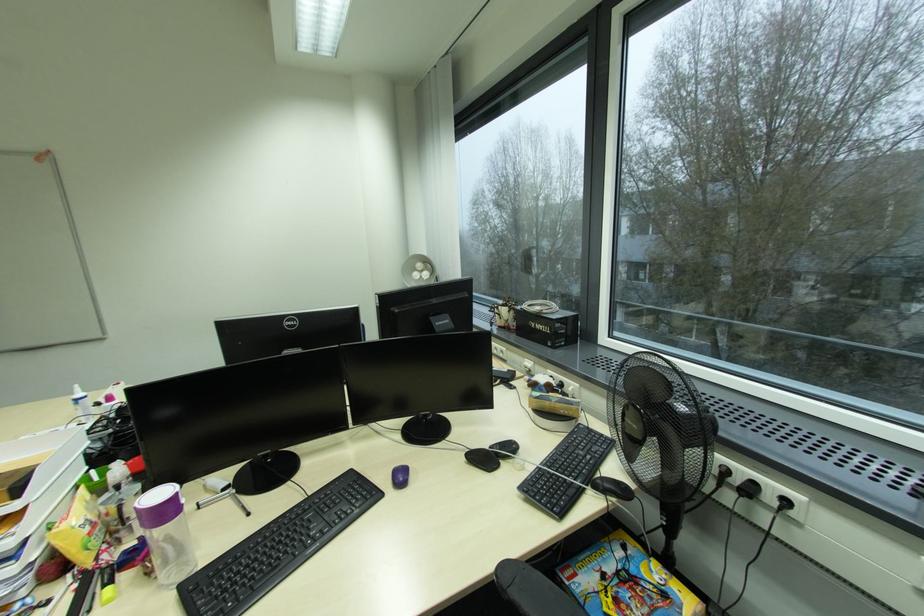
Find the location of a particular element. Image resolution: width=924 pixels, height=616 pixels. black power switch is located at coordinates (391, 536).